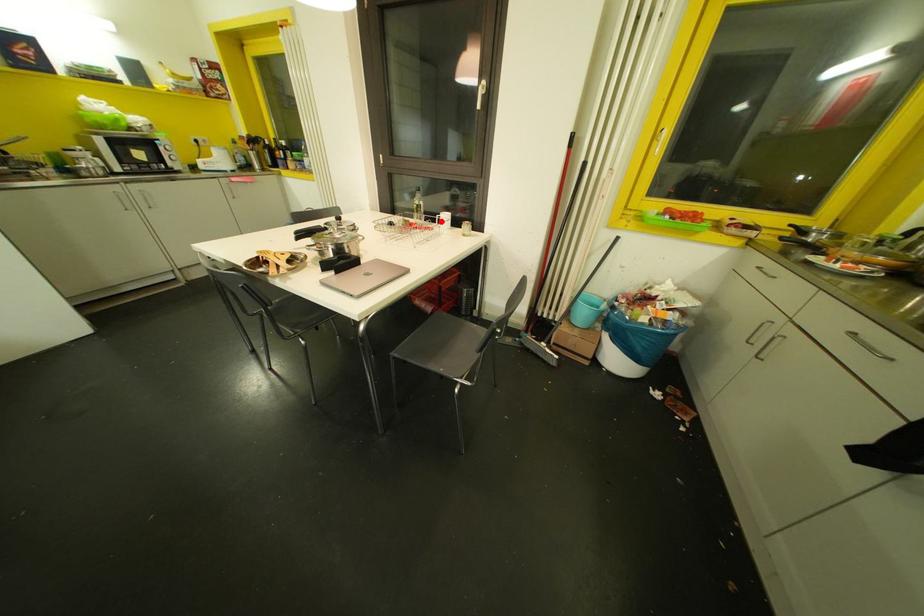
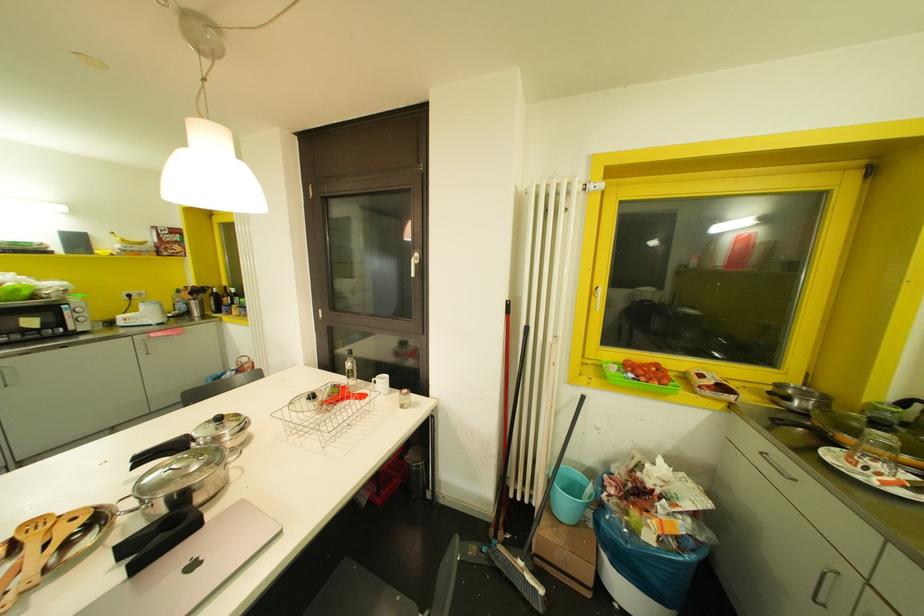
Where in the second image is the point corresponding to the highlighted location from the first image?

(378, 384)